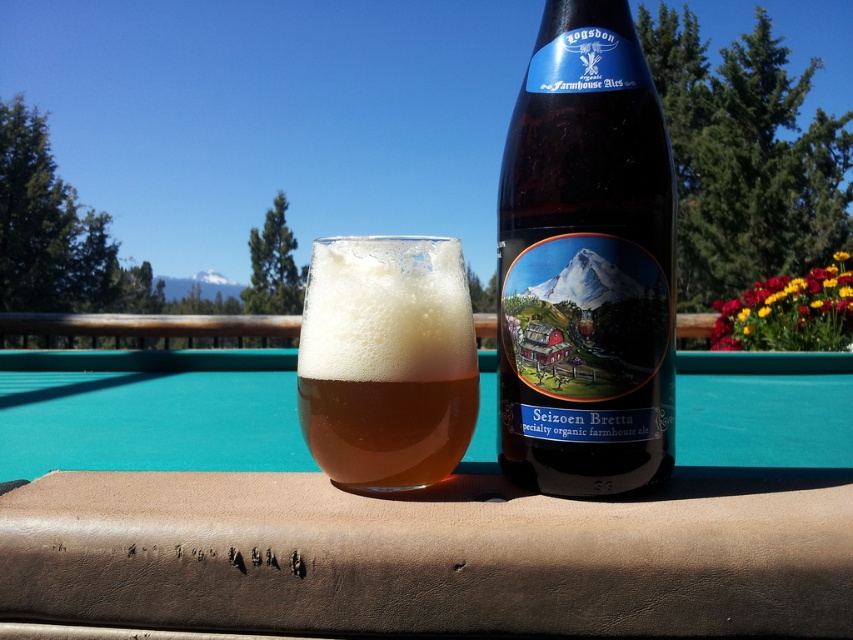
Can you confirm if brown glass bottle at center is positioned below amber glass beer at center?

Actually, brown glass bottle at center is above amber glass beer at center.

Does point (621, 378) come closer to viewer compared to point (357, 388)?

No, (621, 378) is behind (357, 388).

This screenshot has height=640, width=853. I want to click on brown glass bottle at center, so click(x=585, y=262).

Which is more to the right, brown leather table at center or amber glass beer at center?

amber glass beer at center is more to the right.

Between point (236, 563) and point (376, 352), which one is positioned behind?

Positioned behind is point (376, 352).

Is point (833, 634) farther from viewer compared to point (403, 282)?

That is False.

Where is `brown leather table at center`? Image resolution: width=853 pixels, height=640 pixels. brown leather table at center is located at coordinates (410, 509).

Does point (229, 540) lie behind point (585, 240)?

No, (229, 540) is in front of (585, 240).

Can you confirm if brown leather table at center is positioned to the right of brown glass bottle at center?

No, brown leather table at center is not to the right of brown glass bottle at center.

This screenshot has width=853, height=640. In order to click on brown leather table at center in this screenshot , I will do `click(410, 509)`.